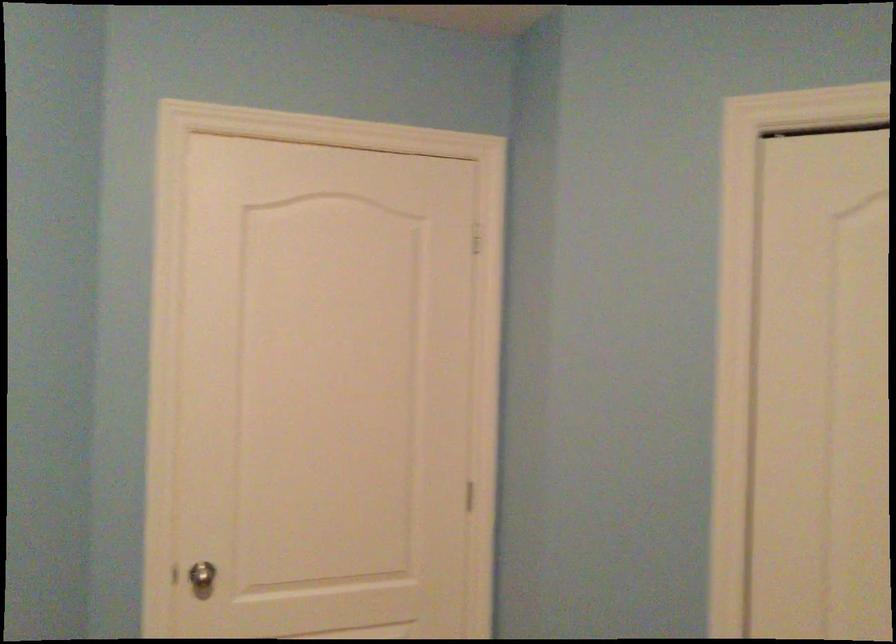
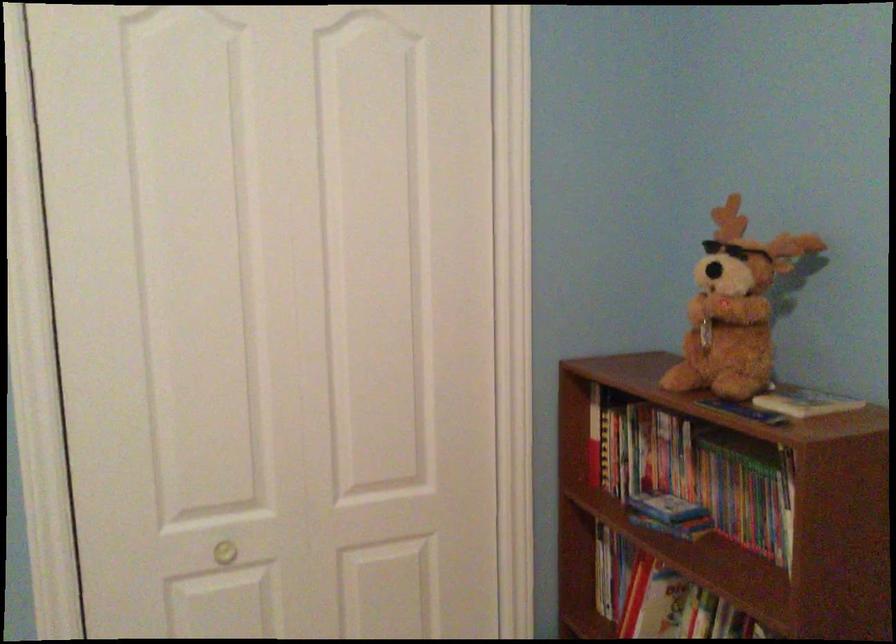
Question: The images are taken continuously from a first-person perspective. In which direction is your viewpoint rotating?

Choices:
 (A) Left
 (B) Right
 (C) Up
 (D) Down

Answer: (B)